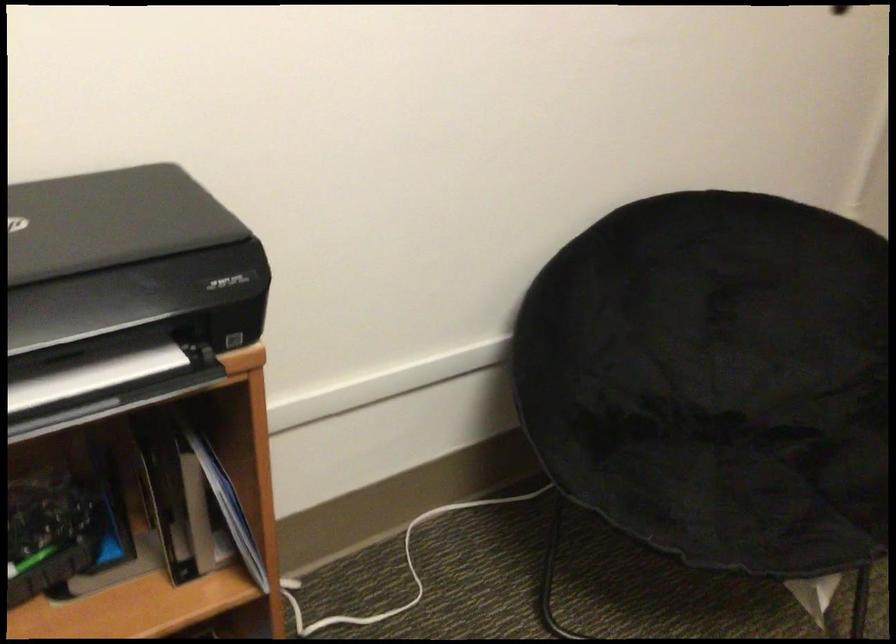
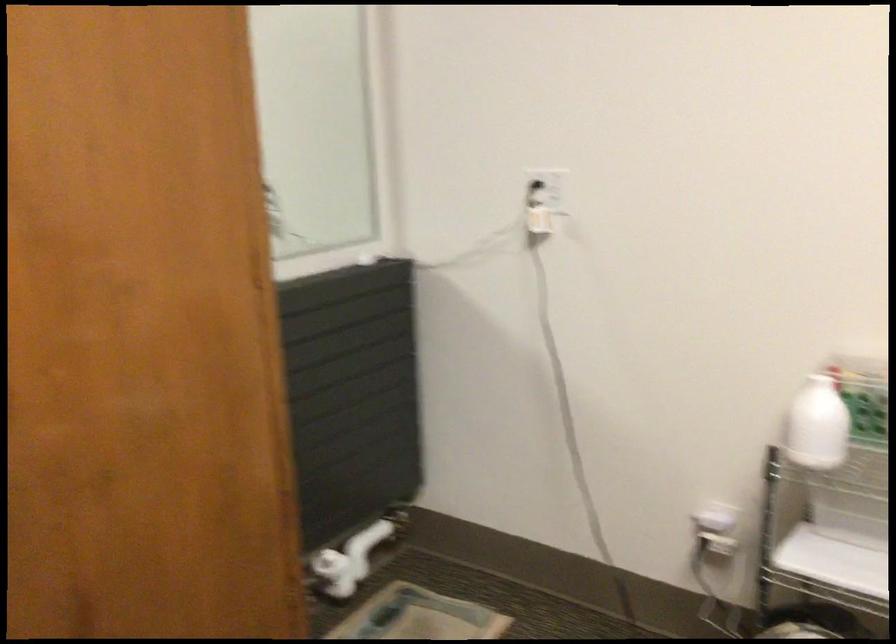
How did the camera likely rotate?

The camera rotated toward right-down.